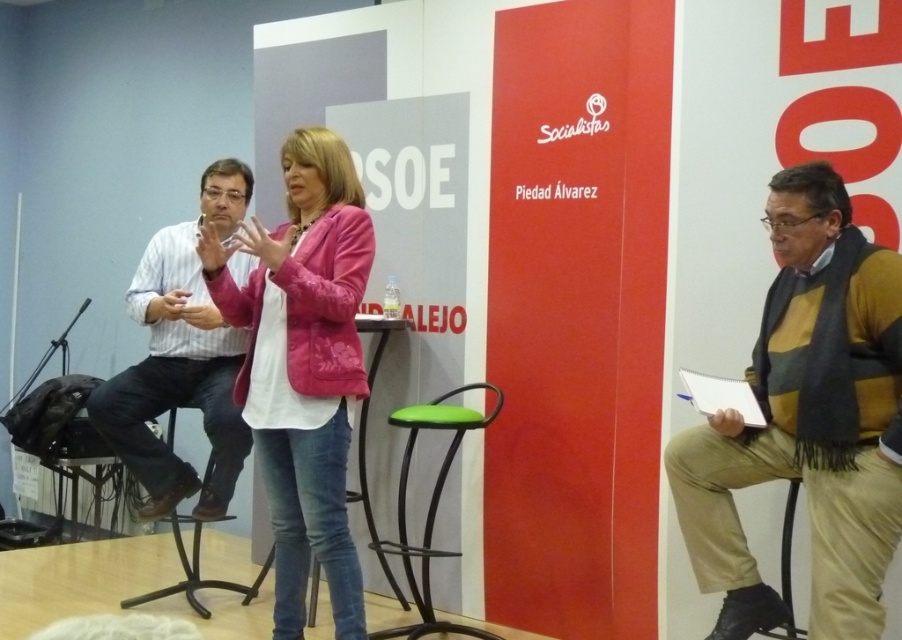
You are attending a public speaking event and notice the pink fabric jacket at center. Can you determine its exact location in the scene?

The pink fabric jacket at center is located at point (302, 365).

You are an event photographer at the scene. You need to capture a photo of both the pink fabric jacket at center and the striped cotton shirt at left in the same frame. Based on their positions, can you position yourself in a way that both are visible without moving either object?

The pink fabric jacket at center is to the right of the striped cotton shirt at left. Since they are positioned side by side with the pink jacket on the right and the striped shirt on the left, you can stand in front of them at a central position to include both in the frame without needing to move either object.